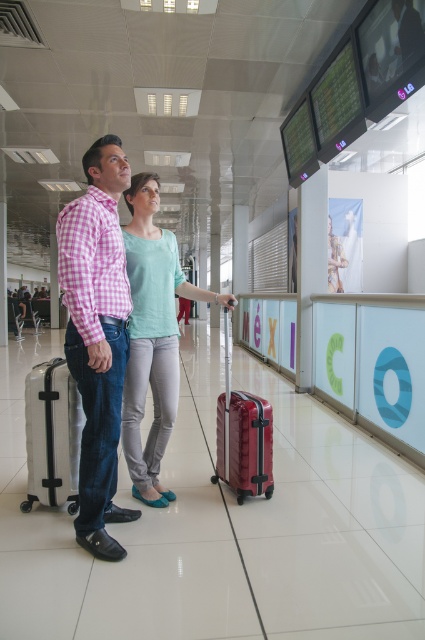
You are a traveler who needs to retrieve your luggage from the airport terminal. You see a black hardshell suitcase at left and a matte red suitcase at center. If your suitcase is 30 inches long, can you determine which one is yours?

The black hardshell suitcase at left is 35.00 inches from matte red suitcase at center. Since your suitcase is 30 inches long, it is shorter than the distance between the two suitcases. Therefore, neither of the suitcases matches your description based on size.

You are a luggage storage attendant who needs to ensure that the pink checkered shirt at center and the matte red suitcase at center are at least 30 inches apart for safety reasons. Based on the scene description, are they currently meeting this requirement?

The pink checkered shirt at center and the matte red suitcase at center are 28.25 inches apart from each other, which is less than the required 30 inches. Therefore, they are not meeting the safety requirement.